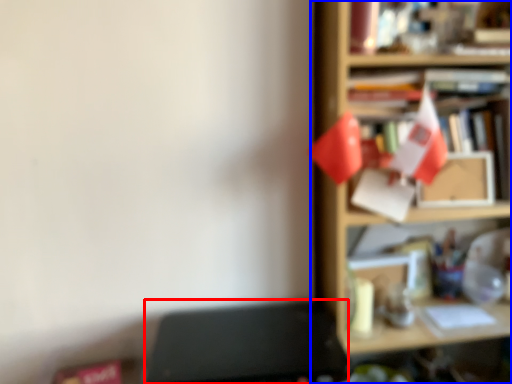
Question: Which of the following is the farthest to the observer, writing desk (highlighted by a red box) or shelf (highlighted by a blue box)?

Choices:
 (A) writing desk
 (B) shelf

Answer: (B)